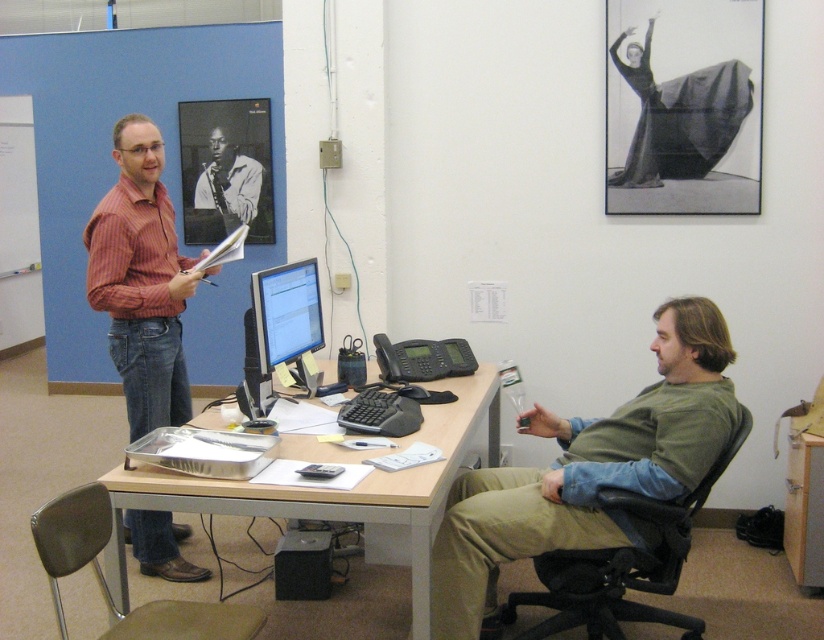
You are a delivery person who needs to place a small package between the wooden desk at center and the black plastic chair at right. The package is 28 inches long. Can you fit it between them?

The wooden desk at center and black plastic chair at right are 26.24 inches apart. Since the package is 28 inches long, which is longer than the space between them, the package cannot fit between them.

Based on the scene description, which object is larger when comparing the matte black monitor at center and the black and white photograph of man playing saxophone at upper left?

The black and white photograph of man playing saxophone at upper left is larger than the matte black monitor at center.